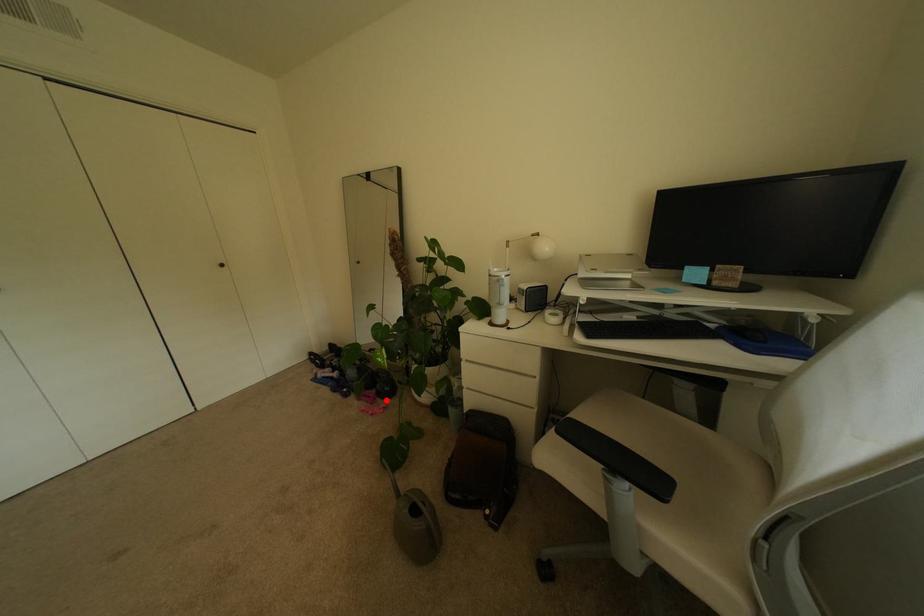
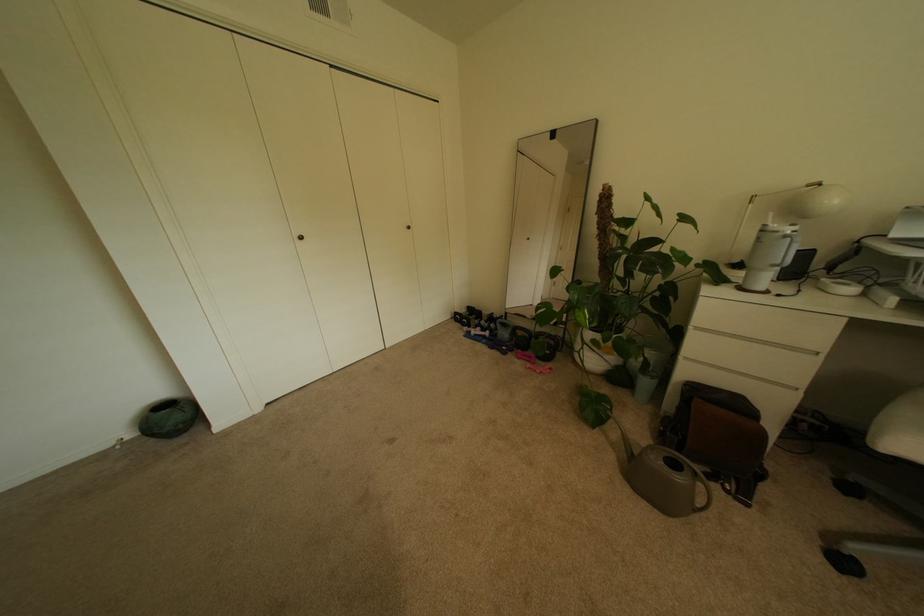
The point at the highlighted location is marked in the first image. Where is the corresponding point in the second image?

(545, 362)